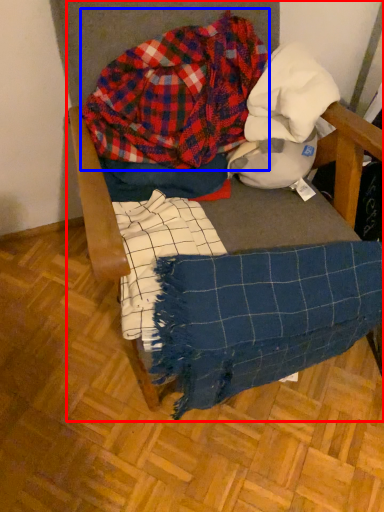
Question: Among these objects, which one is nearest to the camera, furniture (highlighted by a red box) or flannel (highlighted by a blue box)?

Choices:
 (A) furniture
 (B) flannel

Answer: (A)